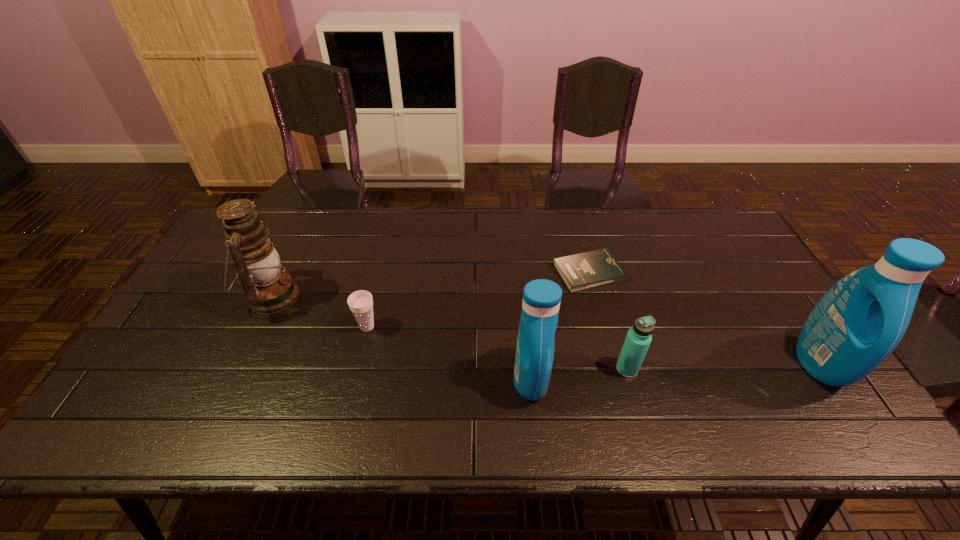
At what (x,y) coordinates should I click in order to perform the action: click on free space located 0.160m on the right of the book. Please return your answer as a coordinate pair (x, y). This screenshot has height=540, width=960. Looking at the image, I should click on (676, 273).

The image size is (960, 540). I want to click on free space located on the right of the cup, so click(x=434, y=327).

Locate an element on the screen. vacant space located on the back of the lantern is located at coordinates (303, 230).

Find the location of a particular element. Image resolution: width=960 pixels, height=540 pixels. vacant space located on the back of the thermos bottle is located at coordinates (607, 298).

Where is `thermos bottle positioned at the near edge`? The image size is (960, 540). thermos bottle positioned at the near edge is located at coordinates (638, 339).

The image size is (960, 540). I want to click on object at the right edge, so coord(859,321).

Where is `object at the near right corner`? The width and height of the screenshot is (960, 540). object at the near right corner is located at coordinates (859, 321).

In the image, there is a desktop. At what (x,y) coordinates should I click in order to perform the action: click on vacant area at the far edge. Please return your answer as a coordinate pair (x, y). The width and height of the screenshot is (960, 540). Looking at the image, I should click on click(488, 228).

You are a GUI agent. You are given a task and a screenshot of the screen. Output one action in this format:
    pyautogui.click(x=<x>, y=<y>)
    Task: Click on the free space at the near edge of the desktop
    The width and height of the screenshot is (960, 540).
    Given the screenshot: What is the action you would take?
    pyautogui.click(x=743, y=401)

The height and width of the screenshot is (540, 960). Find the location of `vacant space at the right edge`. vacant space at the right edge is located at coordinates (796, 350).